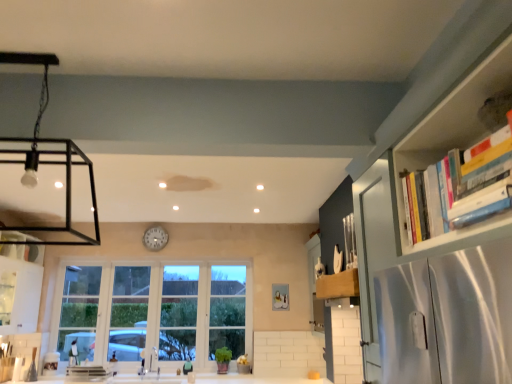
Question: From a real-world perspective, is clear glass window at center located higher than wooden knife block at upper right, which is the first cabinetry in right-to-left order?

Choices:
 (A) yes
 (B) no

Answer: (B)

Question: Is clear glass window at center positioned far away from wooden knife block at upper right, which is the first cabinetry in right-to-left order?

Choices:
 (A) yes
 (B) no

Answer: (A)

Question: Could wooden knife block at upper right, which is counted as the second cabinetry, starting from the left, be considered to be inside clear glass window at center?

Choices:
 (A) no
 (B) yes

Answer: (A)

Question: Could you tell me if clear glass window at center is facing wooden knife block at upper right, which is counted as the second cabinetry, starting from the left?

Choices:
 (A) yes
 (B) no

Answer: (A)

Question: Considering the relative sizes of clear glass window at center and wooden knife block at upper right, which is counted as the second cabinetry, starting from the left, in the image provided, is clear glass window at center smaller than wooden knife block at upper right, which is counted as the second cabinetry, starting from the left,?

Choices:
 (A) no
 (B) yes

Answer: (A)

Question: Considering the positions of white glossy clock at center and hardcover books at upper right in the image, is white glossy clock at center wider or thinner than hardcover books at upper right?

Choices:
 (A) thin
 (B) wide

Answer: (A)

Question: Is white glossy clock at center taller or shorter than hardcover books at upper right?

Choices:
 (A) short
 (B) tall

Answer: (B)

Question: Is point (163, 240) closer or farther from the camera than point (487, 205)?

Choices:
 (A) closer
 (B) farther

Answer: (B)

Question: Is white glossy clock at center bigger or smaller than hardcover books at upper right?

Choices:
 (A) big
 (B) small

Answer: (B)

Question: Is point (94, 375) closer or farther from the camera than point (165, 233)?

Choices:
 (A) farther
 (B) closer

Answer: (B)

Question: Considering their positions, is metallic silver sink at lower center located in front of or behind white glossy clock at center?

Choices:
 (A) front
 (B) behind

Answer: (A)

Question: From a real-world perspective, is metallic silver sink at lower center positioned above or below white glossy clock at center?

Choices:
 (A) below
 (B) above

Answer: (A)

Question: Is metallic silver sink at lower center spatially inside white glossy clock at center, or outside of it?

Choices:
 (A) inside
 (B) outside

Answer: (B)

Question: Looking at the image, does hardcover books at upper right seem bigger or smaller compared to white glossy clock at center?

Choices:
 (A) big
 (B) small

Answer: (A)

Question: Is point (464, 158) closer or farther from the camera than point (156, 246)?

Choices:
 (A) farther
 (B) closer

Answer: (B)